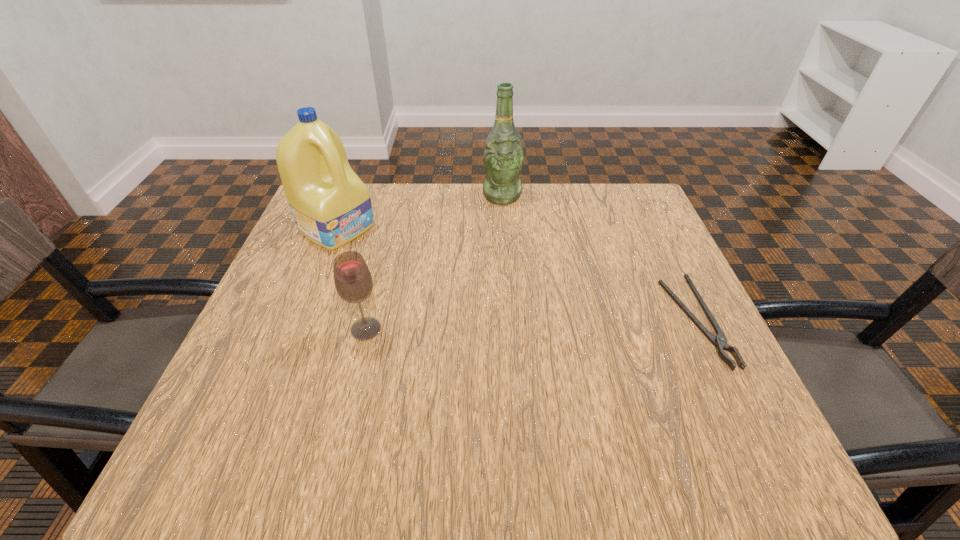
The height and width of the screenshot is (540, 960). Find the location of `the second object from left to right`. the second object from left to right is located at coordinates (352, 278).

Identify the location of the third tallest object. (352, 278).

Where is `the rightmost object`? This screenshot has height=540, width=960. the rightmost object is located at coordinates (720, 341).

Where is `the shortest object`? Image resolution: width=960 pixels, height=540 pixels. the shortest object is located at coordinates (720, 341).

Locate an element on the screen. the leftmost object is located at coordinates (331, 206).

The image size is (960, 540). Find the location of `beer bottle`. beer bottle is located at coordinates (503, 157).

You are a GUI agent. You are given a task and a screenshot of the screen. Output one action in this format:
    pyautogui.click(x=<x>, y=<y>)
    Task: Click on the free space located 0.310m on the back of the glass drink container
    Image resolution: width=960 pixels, height=540 pixels.
    Given the screenshot: What is the action you would take?
    pyautogui.click(x=392, y=226)

Identify the location of free space located on the left of the tongs. Image resolution: width=960 pixels, height=540 pixels. (564, 322).

You are a GUI agent. You are given a task and a screenshot of the screen. Output one action in this format:
    pyautogui.click(x=<x>, y=<y>)
    Task: Click on the vacant point located on the label of the detergent
    
    Given the screenshot: What is the action you would take?
    pyautogui.click(x=470, y=307)

You are a GUI agent. You are given a task and a screenshot of the screen. Output one action in this format:
    pyautogui.click(x=<x>, y=<y>)
    Task: Click on the free space located 0.200m on the label of the detergent
    
    Given the screenshot: What is the action you would take?
    pyautogui.click(x=421, y=278)